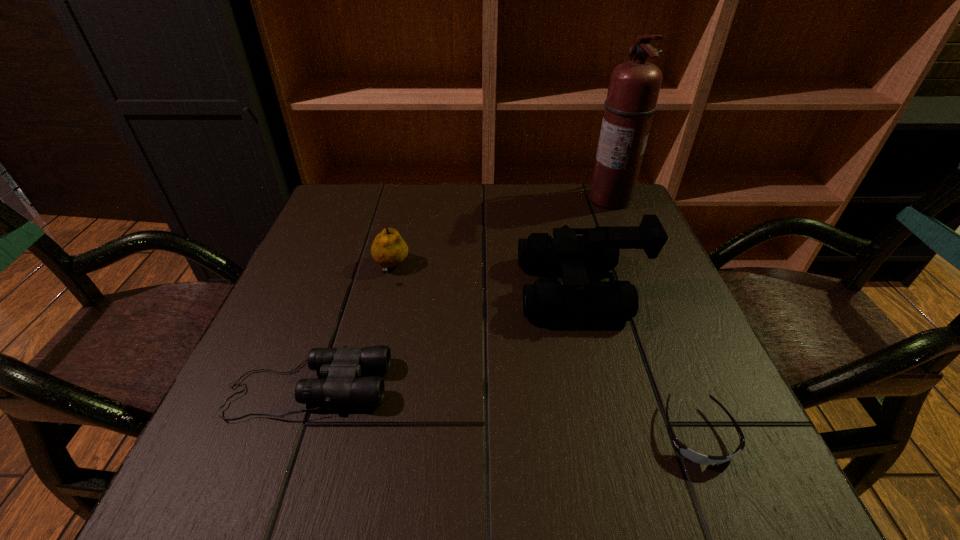
The image size is (960, 540). Find the location of `the tallest object`. the tallest object is located at coordinates (634, 86).

The image size is (960, 540). I want to click on the farthest object, so click(634, 86).

Where is `the second tallest object`? The image size is (960, 540). the second tallest object is located at coordinates click(x=547, y=300).

You are a GUI agent. You are given a task and a screenshot of the screen. Output one action in this format:
    pyautogui.click(x=<x>, y=<y>)
    Task: Click on the farther binoculars
    
    Given the screenshot: What is the action you would take?
    pyautogui.click(x=547, y=300)

The image size is (960, 540). I want to click on pear, so click(x=388, y=249).

The image size is (960, 540). What are the coordinates of `the second shortest object` in the screenshot? It's located at (342, 367).

The height and width of the screenshot is (540, 960). I want to click on the left binoculars, so click(x=342, y=367).

Where is `the shortest object`? The image size is (960, 540). the shortest object is located at coordinates click(682, 449).

In order to click on vacant space located 0.300m on the front-facing side of the farthest object in this screenshot , I will do `click(476, 199)`.

Find the location of a particular element. The height and width of the screenshot is (540, 960). vacant space located 0.210m on the front-facing side of the farthest object is located at coordinates click(x=510, y=199).